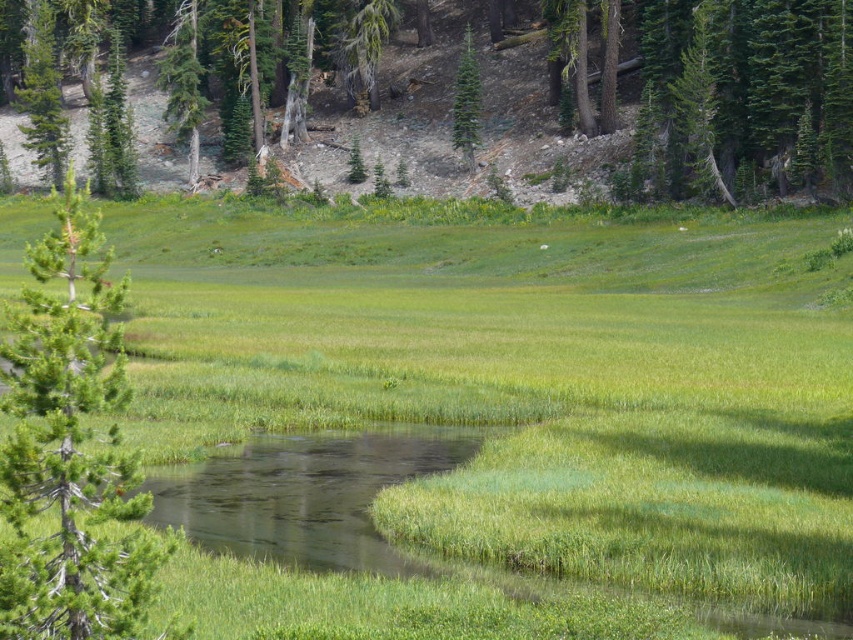
Locate an element on the screen. green grassy at center is located at coordinates (529, 384).

Who is more forward, (202, 204) or (38, 536)?

Point (38, 536) is in front.

Is point (189, 428) positioned after point (65, 291)?

No, (189, 428) is in front of (65, 291).

In order to click on green grassy at center in this screenshot , I will do `click(529, 384)`.

Where is `green textured pine tree at left`? This screenshot has height=640, width=853. green textured pine tree at left is located at coordinates (70, 449).

Between point (25, 445) and point (467, 100), which one is positioned in front?

Point (25, 445)

Locate an element on the screen. This screenshot has height=640, width=853. green textured pine tree at left is located at coordinates (70, 449).

Does green leafy tree at upper center appear under green textured pine tree at center?

No, green leafy tree at upper center is not below green textured pine tree at center.

Where is `green leafy tree at upper center`? Image resolution: width=853 pixels, height=640 pixels. green leafy tree at upper center is located at coordinates (688, 93).